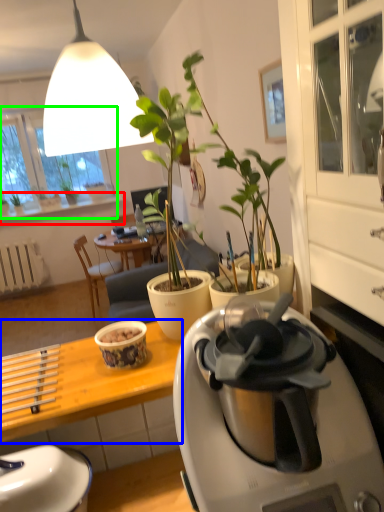
Question: Which is farther away from window sill (highlighted by a red box)? desk (highlighted by a blue box) or window screen (highlighted by a green box)?

Choices:
 (A) desk
 (B) window screen

Answer: (A)